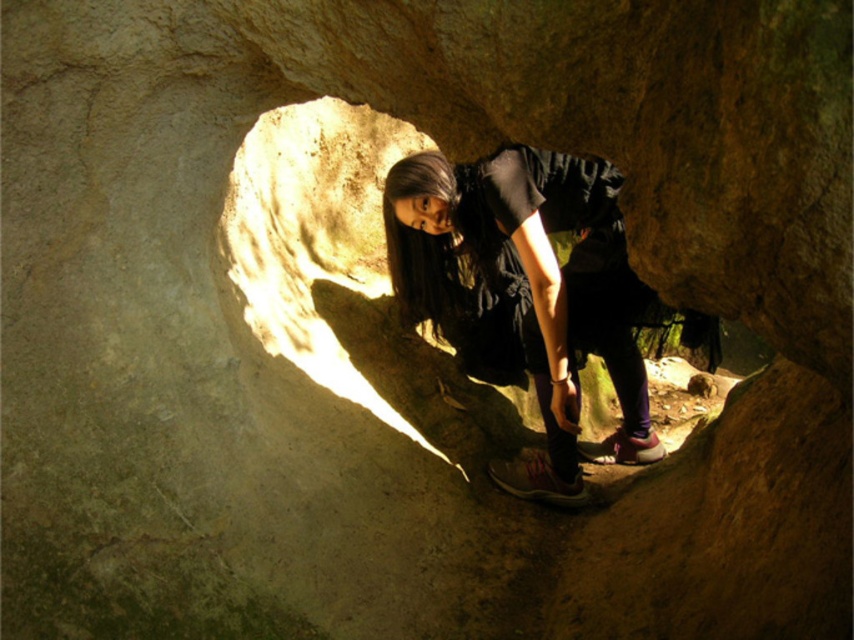
You are navigating through a dark tunnel and want to move towards the exit. You have two points marked on the tunnel wall. Which point, point (262, 324) or point (490, 480), is closer to you as you face the tunnel exit?

Point (262, 324) is closer to the camera than point (490, 480), so it is closer to you as you face the tunnel exit.

You are inside a dark tunnel with a bright opening behind you. You notice a smooth stone hole at center and a matte pink sneaker at lower center. Which object is nearer to you?

→ The smooth stone hole at center is closer to the viewer than the matte pink sneaker at lower center.

You are a hiker who has just entered this dark tunnel and want to check your gear. You have a matte black dress at center and a matte pink sneaker at lower center in your backpack. Which item will take up more space in your backpack?

The matte black dress at center is larger in size than the matte pink sneaker at lower center, so it will take up more space in your backpack.